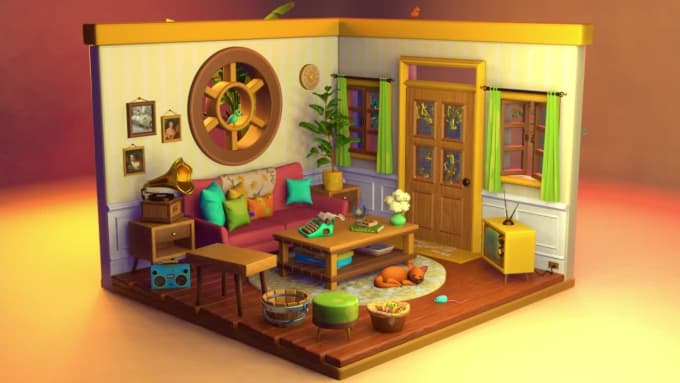
You are a GUI agent. You are given a task and a screenshot of the screen. Output one action in this format:
    pyautogui.click(x=<x>, y=<y>)
    Task: Click on the tv
    The image size is (680, 383).
    Given the screenshot: What is the action you would take?
    pyautogui.click(x=511, y=249)